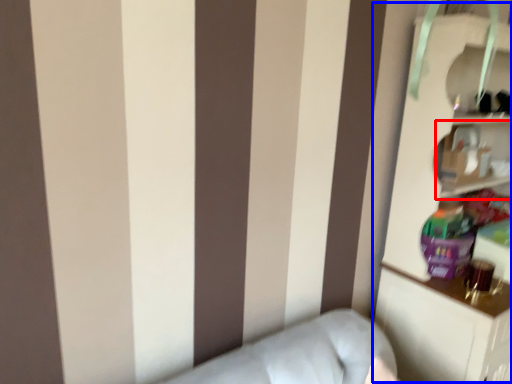
Question: Which point is closer to the camera, cabinet (highlighted by a red box) or bookcase (highlighted by a blue box)?

Choices:
 (A) cabinet
 (B) bookcase

Answer: (B)